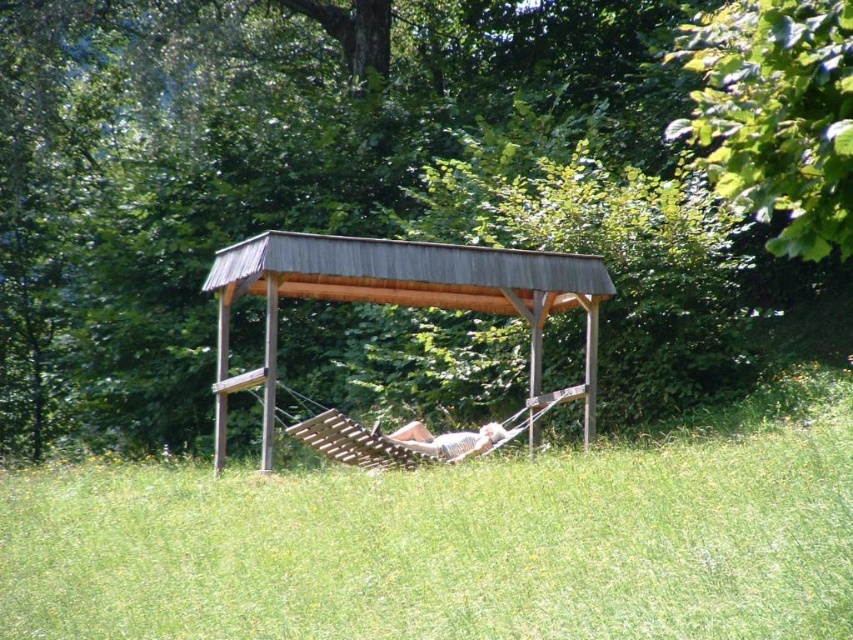
Does point (308, 266) lie in front of point (457, 460)?

Yes, point (308, 266) is in front of point (457, 460).

Looking at this image, between brown wooden gazebo at center and light brown wooden hammock at center, which one has more height?

brown wooden gazebo at center is taller.

Measure the distance between brown wooden gazebo at center and camera.

brown wooden gazebo at center and camera are 42.69 feet apart.

Identify the location of brown wooden gazebo at center. (401, 298).

Who is positioned more to the right, green leafy tree at upper right or brown wooden gazebo at center?

green leafy tree at upper right is more to the right.

Can you confirm if green leafy tree at upper right is positioned above brown wooden gazebo at center?

Indeed, green leafy tree at upper right is positioned over brown wooden gazebo at center.

Measure the distance between point (775, 184) and camera.

They are 8.23 meters apart.

Locate an element on the screen. The image size is (853, 640). green leafy tree at upper right is located at coordinates (776, 115).

From the picture: Who is higher up, green grass at center or light brown wooden hammock at center?

light brown wooden hammock at center is above.

Is green grass at center closer to camera compared to light brown wooden hammock at center?

Yes, it is in front of light brown wooden hammock at center.

Is point (776, 563) less distant than point (456, 449)?

Yes, point (776, 563) is closer to viewer.

This screenshot has height=640, width=853. What are the coordinates of `green grass at center` in the screenshot? It's located at (450, 545).